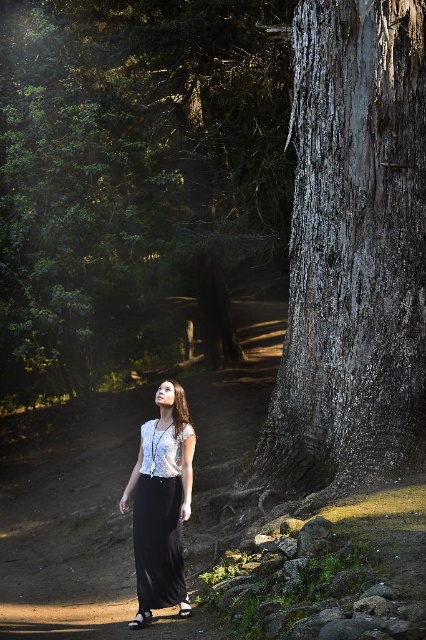
Between gray textured bark at center and white lace blouse at center, which one has less height?

Standing shorter between the two is white lace blouse at center.

Which is in front, point (379, 84) or point (175, 545)?

Point (175, 545) is in front.

You are a GUI agent. You are given a task and a screenshot of the screen. Output one action in this format:
    pyautogui.click(x=<x>, y=<y>)
    Task: Click on the gray textured bark at center
    
    Given the screenshot: What is the action you would take?
    pyautogui.click(x=351, y=252)